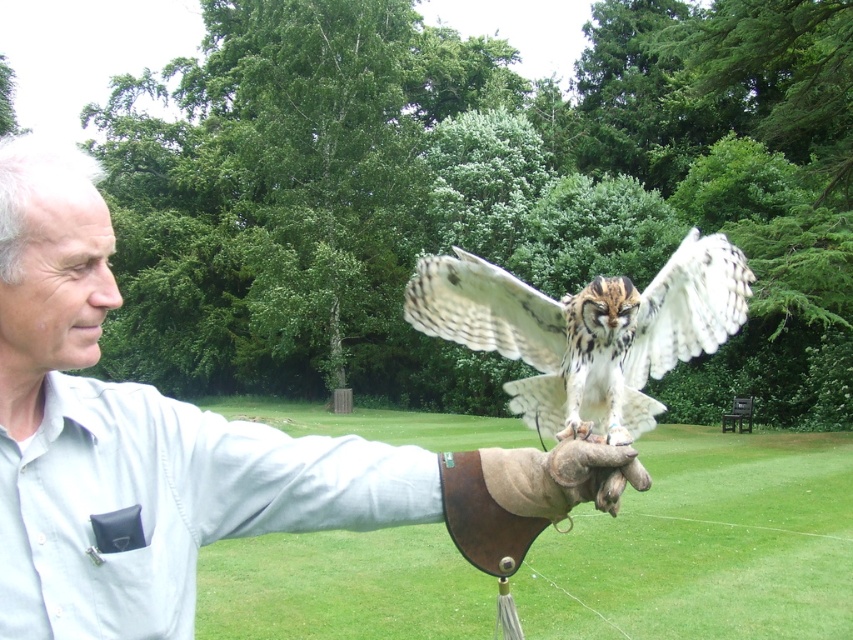
Is point (41, 438) in front of point (579, 484)?

Yes, point (41, 438) is in front of point (579, 484).

Measure the distance between light blue shirt at center and leather glove at center.

light blue shirt at center is 12.23 inches away from leather glove at center.

Between point (70, 404) and point (601, 445), which one is positioned in front?

Positioned in front is point (70, 404).

The image size is (853, 640). In order to click on light blue shirt at center in this screenshot , I will do `click(173, 445)`.

Between white feathered owl at center and leather glove at center, which one is positioned higher?

white feathered owl at center is higher up.

This screenshot has width=853, height=640. Identify the location of white feathered owl at center. (585, 330).

This screenshot has height=640, width=853. I want to click on white feathered owl at center, so click(x=585, y=330).

Who is positioned more to the left, light blue shirt at center or white feathered owl at center?

From the viewer's perspective, light blue shirt at center appears more on the left side.

The height and width of the screenshot is (640, 853). Describe the element at coordinates (173, 445) in the screenshot. I see `light blue shirt at center` at that location.

Is point (515, 452) more distant than point (670, 296)?

That is False.

Where is `light blue shirt at center`? Image resolution: width=853 pixels, height=640 pixels. light blue shirt at center is located at coordinates (173, 445).